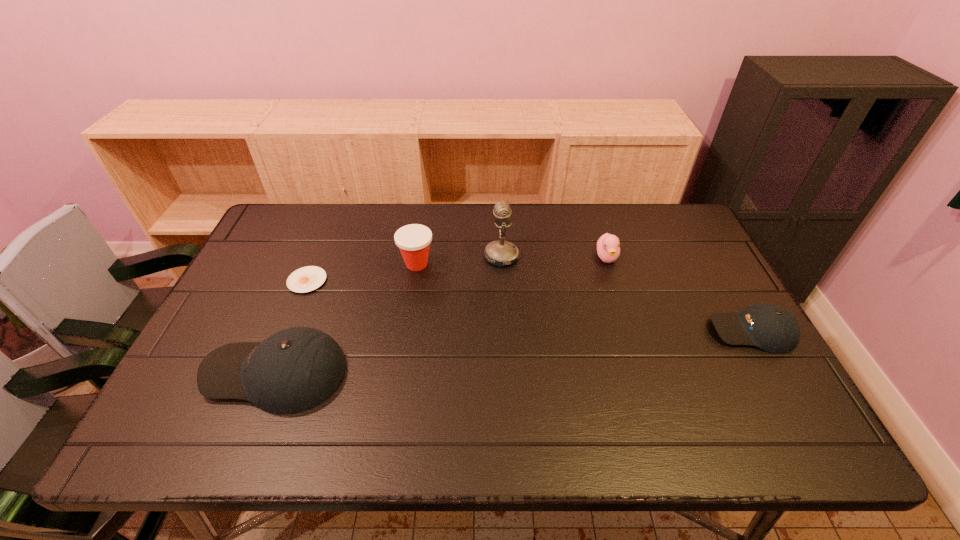
You are a GUI agent. You are given a task and a screenshot of the screen. Output one action in this format:
    pyautogui.click(x=<x>, y=<y>)
    Task: Click on the free space at the far left corner
    Image resolution: width=960 pixels, height=540 pixels.
    Given the screenshot: What is the action you would take?
    pyautogui.click(x=279, y=245)

Locate an element on the screen. free region at the near left corner of the desktop is located at coordinates (180, 387).

Where is `vacant space at the far right corner of the desktop`? vacant space at the far right corner of the desktop is located at coordinates (702, 245).

Image resolution: width=960 pixels, height=540 pixels. I want to click on vacant region between the right baseball cap and the microphone, so click(x=627, y=294).

This screenshot has width=960, height=540. Identify the location of vacant point located between the egg yolk and the Dixie cup. (362, 272).

Where is `free area in between the second shortest object and the third shortest object`? The image size is (960, 540). free area in between the second shortest object and the third shortest object is located at coordinates coord(679,294).

Find the location of a particular element. vacant area between the microphone and the fifth object from left to right is located at coordinates (554, 257).

You are a GUI agent. You are given a task and a screenshot of the screen. Output one action in this format:
    pyautogui.click(x=<x>, y=<y>)
    Task: Click on the free space between the third shortest object and the shortest object
    The width and height of the screenshot is (960, 540).
    Given the screenshot: What is the action you would take?
    pyautogui.click(x=457, y=269)

This screenshot has width=960, height=540. I want to click on empty location between the right baseball cap and the microphone, so click(x=627, y=294).

Image resolution: width=960 pixels, height=540 pixels. What are the coordinates of `blank region between the right baseball cap and the microphone` in the screenshot? It's located at (627, 294).